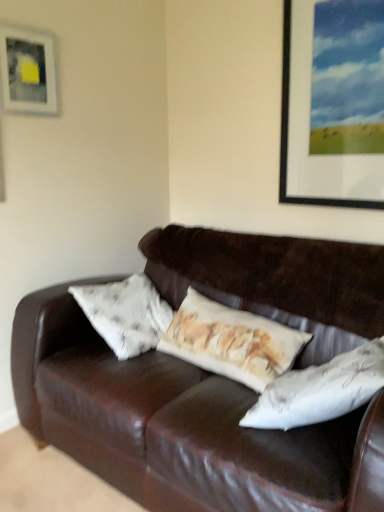
Describe the element at coordinates (333, 103) in the screenshot. I see `metallic silver picture frame at upper right, placed as the 2th picture frame when sorted from left to right` at that location.

Where is `metallic silver picture frame at upper right, placed as the 2th picture frame when sorted from left to right`? metallic silver picture frame at upper right, placed as the 2th picture frame when sorted from left to right is located at coordinates (333, 103).

Find the location of a particular element. The image size is (384, 512). matte white picture frame at upper left, placed as the first picture frame when sorted from left to right is located at coordinates tap(28, 70).

In order to face matte white picture frame at upper left, placed as the first picture frame when sorted from left to right, should I rotate leftwards or rightwards?

Rotate left and turn 21.070 degrees.

What do you see at coordinates (28, 70) in the screenshot? The height and width of the screenshot is (512, 384). I see `matte white picture frame at upper left, positioned as the second picture frame in right-to-left order` at bounding box center [28, 70].

Identify the location of metallic silver picture frame at upper right, the first picture frame from the right. This screenshot has height=512, width=384. (333, 103).

Is matte white picture frame at upper left, placed as the first picture frame when sorted from left to right, to the left or to the right of metallic silver picture frame at upper right, placed as the 2th picture frame when sorted from left to right, in the image?

matte white picture frame at upper left, placed as the first picture frame when sorted from left to right, is to the left of metallic silver picture frame at upper right, placed as the 2th picture frame when sorted from left to right.

Considering their positions, is matte white picture frame at upper left, placed as the first picture frame when sorted from left to right, located in front of or behind metallic silver picture frame at upper right, placed as the 2th picture frame when sorted from left to right?

Clearly, matte white picture frame at upper left, placed as the first picture frame when sorted from left to right, is behind metallic silver picture frame at upper right, placed as the 2th picture frame when sorted from left to right.

Is point (38, 46) more distant than point (377, 104)?

Yes.

From the image's perspective, is matte white picture frame at upper left, placed as the first picture frame when sorted from left to right, positioned above or below metallic silver picture frame at upper right, placed as the 2th picture frame when sorted from left to right?

From the image's perspective, matte white picture frame at upper left, placed as the first picture frame when sorted from left to right, appears above metallic silver picture frame at upper right, placed as the 2th picture frame when sorted from left to right.

From a real-world perspective, who is located lower, matte white picture frame at upper left, positioned as the second picture frame in right-to-left order, or metallic silver picture frame at upper right, the first picture frame from the right?

In real-world perspective, metallic silver picture frame at upper right, the first picture frame from the right, is lower.

Is matte white picture frame at upper left, placed as the first picture frame when sorted from left to right, wider or thinner than metallic silver picture frame at upper right, placed as the 2th picture frame when sorted from left to right?

matte white picture frame at upper left, placed as the first picture frame when sorted from left to right, is thinner than metallic silver picture frame at upper right, placed as the 2th picture frame when sorted from left to right.

Considering the relative sizes of matte white picture frame at upper left, placed as the first picture frame when sorted from left to right, and metallic silver picture frame at upper right, placed as the 2th picture frame when sorted from left to right, in the image provided, is matte white picture frame at upper left, placed as the first picture frame when sorted from left to right, shorter than metallic silver picture frame at upper right, placed as the 2th picture frame when sorted from left to right,?

Yes, matte white picture frame at upper left, placed as the first picture frame when sorted from left to right, is shorter than metallic silver picture frame at upper right, placed as the 2th picture frame when sorted from left to right.

Who is bigger, matte white picture frame at upper left, placed as the first picture frame when sorted from left to right, or metallic silver picture frame at upper right, placed as the 2th picture frame when sorted from left to right?

Bigger between the two is metallic silver picture frame at upper right, placed as the 2th picture frame when sorted from left to right.

Is matte white picture frame at upper left, placed as the first picture frame when sorted from left to right, located outside metallic silver picture frame at upper right, the first picture frame from the right?

matte white picture frame at upper left, placed as the first picture frame when sorted from left to right, is positioned outside metallic silver picture frame at upper right, the first picture frame from the right.

Is matte white picture frame at upper left, positioned as the second picture frame in right-to-left order, next to metallic silver picture frame at upper right, placed as the 2th picture frame when sorted from left to right?

No, matte white picture frame at upper left, positioned as the second picture frame in right-to-left order, is not next to metallic silver picture frame at upper right, placed as the 2th picture frame when sorted from left to right.

Looking at this image, does matte white picture frame at upper left, positioned as the second picture frame in right-to-left order, turn towards metallic silver picture frame at upper right, placed as the 2th picture frame when sorted from left to right?

No, matte white picture frame at upper left, positioned as the second picture frame in right-to-left order, is not oriented towards metallic silver picture frame at upper right, placed as the 2th picture frame when sorted from left to right.

How many degrees apart are the facing directions of matte white picture frame at upper left, positioned as the second picture frame in right-to-left order, and metallic silver picture frame at upper right, placed as the 2th picture frame when sorted from left to right?

The facing directions of matte white picture frame at upper left, positioned as the second picture frame in right-to-left order, and metallic silver picture frame at upper right, placed as the 2th picture frame when sorted from left to right, are 89.1 degrees apart.

Identify the location of picture frame on the right of matte white picture frame at upper left, positioned as the second picture frame in right-to-left order. The width and height of the screenshot is (384, 512). pyautogui.click(x=333, y=103).

Considering the relative positions of metallic silver picture frame at upper right, the first picture frame from the right, and matte white picture frame at upper left, placed as the first picture frame when sorted from left to right, in the image provided, is metallic silver picture frame at upper right, the first picture frame from the right, to the right of matte white picture frame at upper left, placed as the first picture frame when sorted from left to right, from the viewer's perspective?

Yes, metallic silver picture frame at upper right, the first picture frame from the right, is to the right of matte white picture frame at upper left, placed as the first picture frame when sorted from left to right.

Which is in front, metallic silver picture frame at upper right, placed as the 2th picture frame when sorted from left to right, or matte white picture frame at upper left, positioned as the second picture frame in right-to-left order?

metallic silver picture frame at upper right, placed as the 2th picture frame when sorted from left to right, is closer to the camera.

Does point (322, 97) appear closer or farther from the camera than point (19, 85)?

Point (322, 97) is farther from the camera than point (19, 85).

From the image's perspective, does metallic silver picture frame at upper right, placed as the 2th picture frame when sorted from left to right, appear lower than matte white picture frame at upper left, placed as the first picture frame when sorted from left to right?

Indeed, from the image's perspective, metallic silver picture frame at upper right, placed as the 2th picture frame when sorted from left to right, is shown beneath matte white picture frame at upper left, placed as the first picture frame when sorted from left to right.

From a real-world perspective, which is physically below, metallic silver picture frame at upper right, placed as the 2th picture frame when sorted from left to right, or matte white picture frame at upper left, placed as the first picture frame when sorted from left to right?

metallic silver picture frame at upper right, placed as the 2th picture frame when sorted from left to right, is physically lower.

Consider the image. Which of these two, metallic silver picture frame at upper right, placed as the 2th picture frame when sorted from left to right, or matte white picture frame at upper left, placed as the first picture frame when sorted from left to right, is thinner?

matte white picture frame at upper left, placed as the first picture frame when sorted from left to right.

Does metallic silver picture frame at upper right, the first picture frame from the right, have a lesser height compared to matte white picture frame at upper left, positioned as the second picture frame in right-to-left order?

No.

Who is bigger, metallic silver picture frame at upper right, the first picture frame from the right, or matte white picture frame at upper left, placed as the first picture frame when sorted from left to right?

metallic silver picture frame at upper right, the first picture frame from the right.

Can we say metallic silver picture frame at upper right, placed as the 2th picture frame when sorted from left to right, lies outside matte white picture frame at upper left, positioned as the second picture frame in right-to-left order?

Yes.

Is there a large distance between metallic silver picture frame at upper right, placed as the 2th picture frame when sorted from left to right, and matte white picture frame at upper left, placed as the first picture frame when sorted from left to right?

metallic silver picture frame at upper right, placed as the 2th picture frame when sorted from left to right, is far away from matte white picture frame at upper left, placed as the first picture frame when sorted from left to right.

Could you tell me if metallic silver picture frame at upper right, the first picture frame from the right, is turned towards matte white picture frame at upper left, placed as the first picture frame when sorted from left to right?

No, metallic silver picture frame at upper right, the first picture frame from the right, is not turned towards matte white picture frame at upper left, placed as the first picture frame when sorted from left to right.

From the picture: What's the angular difference between metallic silver picture frame at upper right, placed as the 2th picture frame when sorted from left to right, and matte white picture frame at upper left, placed as the first picture frame when sorted from left to right,'s facing directions?

89.1 degrees.

Where is `picture frame below the matte white picture frame at upper left, positioned as the second picture frame in right-to-left order (from the image's perspective)`? This screenshot has width=384, height=512. picture frame below the matte white picture frame at upper left, positioned as the second picture frame in right-to-left order (from the image's perspective) is located at coordinates (333, 103).

In order to click on picture frame below the matte white picture frame at upper left, placed as the first picture frame when sorted from left to right (from the image's perspective) in this screenshot , I will do `click(333, 103)`.

The image size is (384, 512). Find the location of `picture frame below the matte white picture frame at upper left, placed as the first picture frame when sorted from left to right (from a real-world perspective)`. picture frame below the matte white picture frame at upper left, placed as the first picture frame when sorted from left to right (from a real-world perspective) is located at coordinates (333, 103).